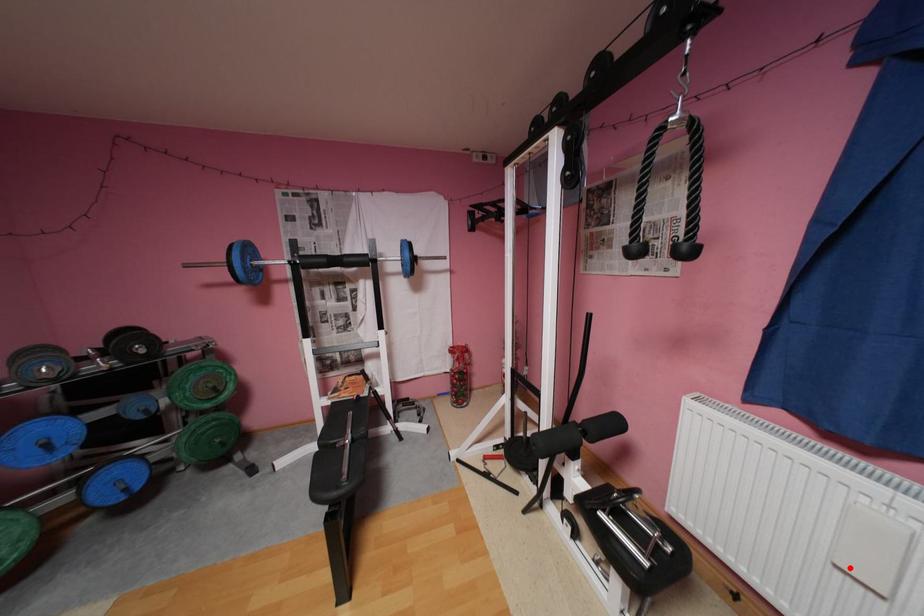
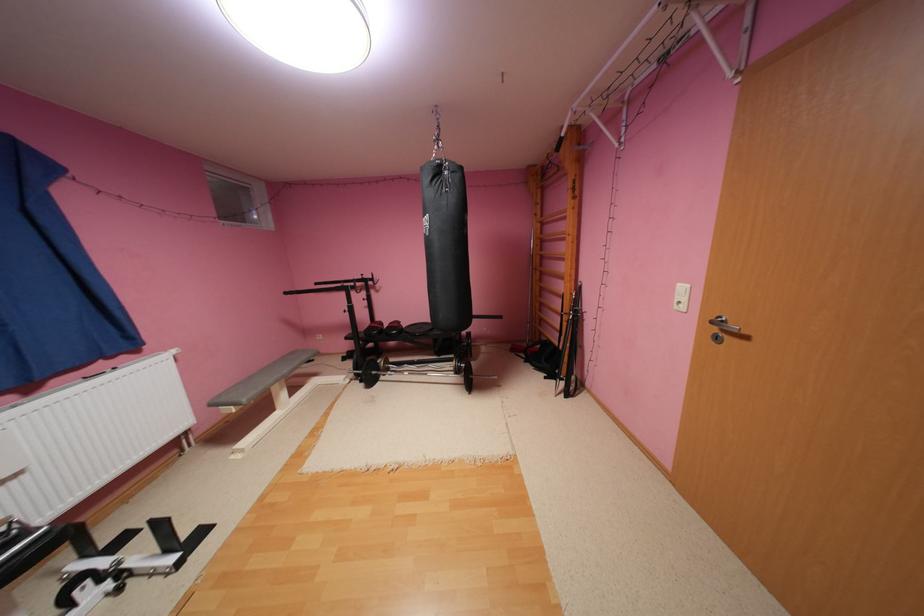
Locate, in the second image, the point that corresponds to the highlighted location in the first image.

(11, 483)